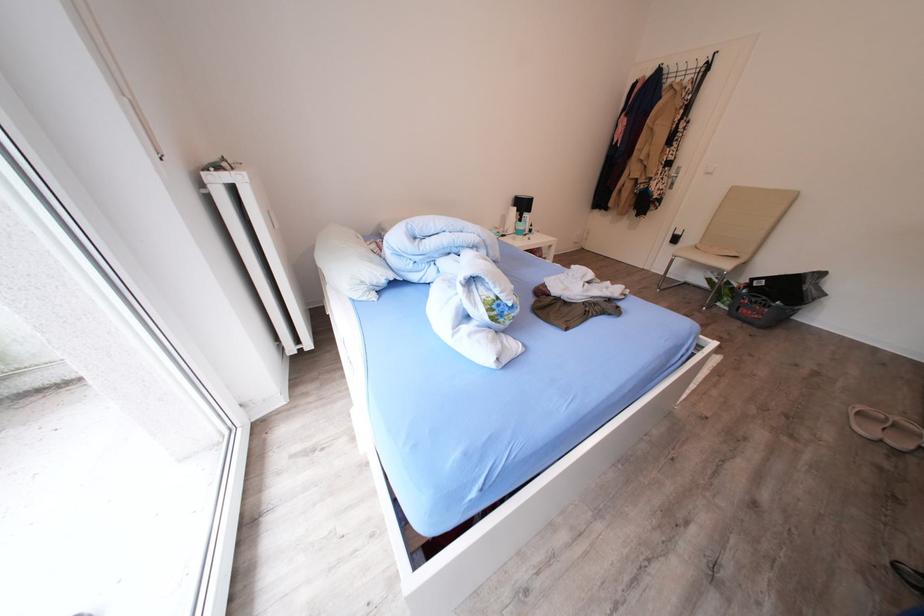
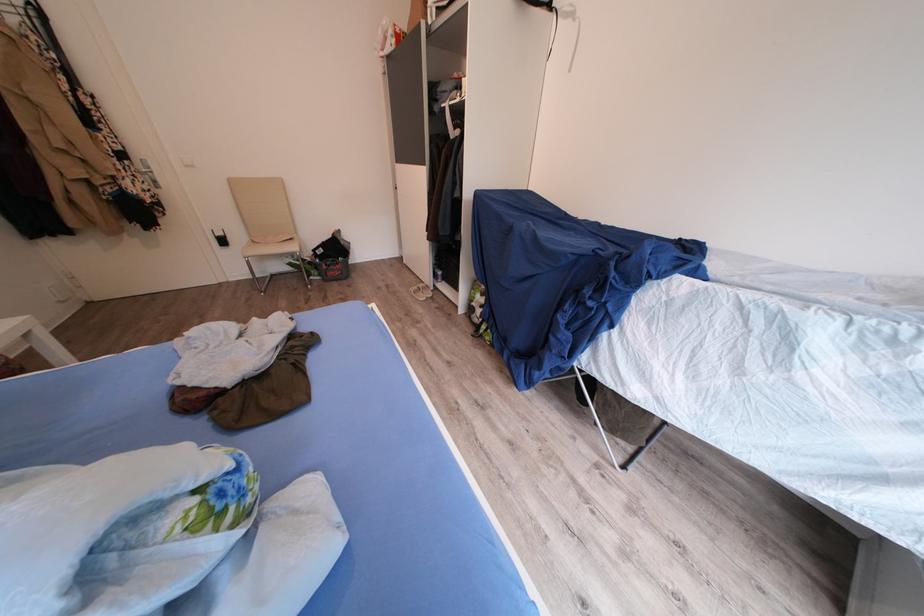
The point at (738, 310) is marked in the first image. Where is the corresponding point in the second image?

(329, 281)